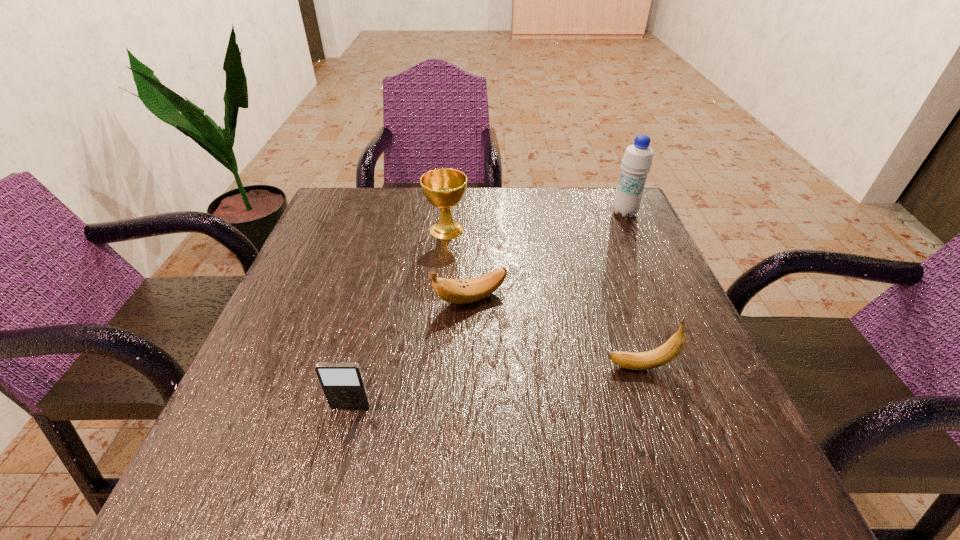
Locate an element on the screen. object at the far right corner is located at coordinates (637, 161).

At what (x,y) coordinates should I click in order to perform the action: click on vacant space at the far edge of the desktop. Please return your answer as a coordinate pair (x, y). This screenshot has width=960, height=540. Looking at the image, I should click on (456, 217).

Locate an element on the screen. The image size is (960, 540). vacant space at the left edge of the desktop is located at coordinates (264, 421).

The height and width of the screenshot is (540, 960). I want to click on vacant position at the right edge of the desktop, so pyautogui.click(x=697, y=437).

In the image, there is a desktop. In order to click on vacant space at the far left corner in this screenshot , I will do `click(339, 214)`.

The width and height of the screenshot is (960, 540). In the image, there is a desktop. In order to click on free region at the far right corner in this screenshot , I will do `click(567, 191)`.

In the image, there is a desktop. What are the coordinates of `free space at the near right corner` in the screenshot? It's located at (691, 483).

Where is `free space that is in between the chalice and the nearest object`? This screenshot has width=960, height=540. free space that is in between the chalice and the nearest object is located at coordinates (398, 318).

Locate an element on the screen. free space that is in between the chalice and the taller banana is located at coordinates (543, 298).

Image resolution: width=960 pixels, height=540 pixels. What are the coordinates of `free space that is in between the chalice and the water bottle` in the screenshot? It's located at (536, 221).